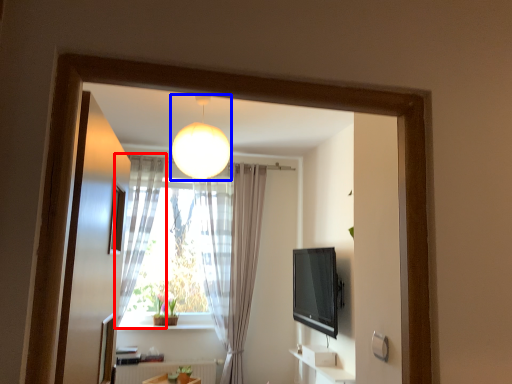
Question: Which object appears farthest to the camera in this image, curtain (highlighted by a red box) or lamp (highlighted by a blue box)?

Choices:
 (A) curtain
 (B) lamp

Answer: (A)